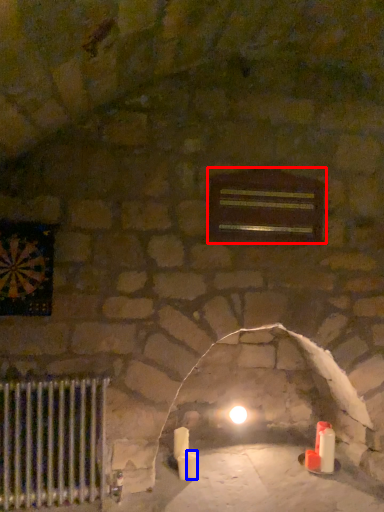
Question: Which object is further to the camera taking this photo, window (highlighted by a red box) or candle (highlighted by a blue box)?

Choices:
 (A) window
 (B) candle

Answer: (B)